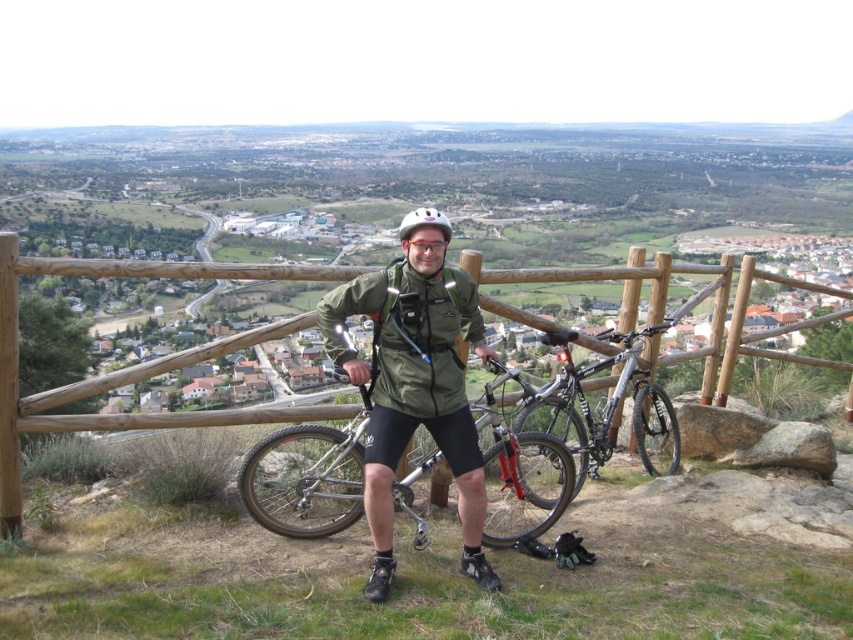
Which is more to the left, green matte jacket at center or wooden at center?

Positioned to the left is wooden at center.

Which is in front, point (364, 381) or point (242, 410)?

Point (364, 381)

Where is `green matte jacket at center`? The width and height of the screenshot is (853, 640). green matte jacket at center is located at coordinates (415, 381).

What are the coordinates of `green matte jacket at center` in the screenshot? It's located at (415, 381).

Is point (444, 237) positioned before point (556, 513)?

No.

Locate an element on the screen. green matte jacket at center is located at coordinates (415, 381).

Is wooden at center wider than silver metallic bicycle at center?

Indeed, wooden at center has a greater width compared to silver metallic bicycle at center.

Consider the image. Does wooden at center lie in front of silver metallic bicycle at center?

That is True.

Between point (18, 518) and point (654, 428), which one is positioned in front?

Point (18, 518) is more forward.

You are a GUI agent. You are given a task and a screenshot of the screen. Output one action in this format:
    pyautogui.click(x=<x>, y=<y>)
    Task: Click on the wooden at center
    
    Given the screenshot: What is the action you would take?
    pyautogui.click(x=131, y=365)